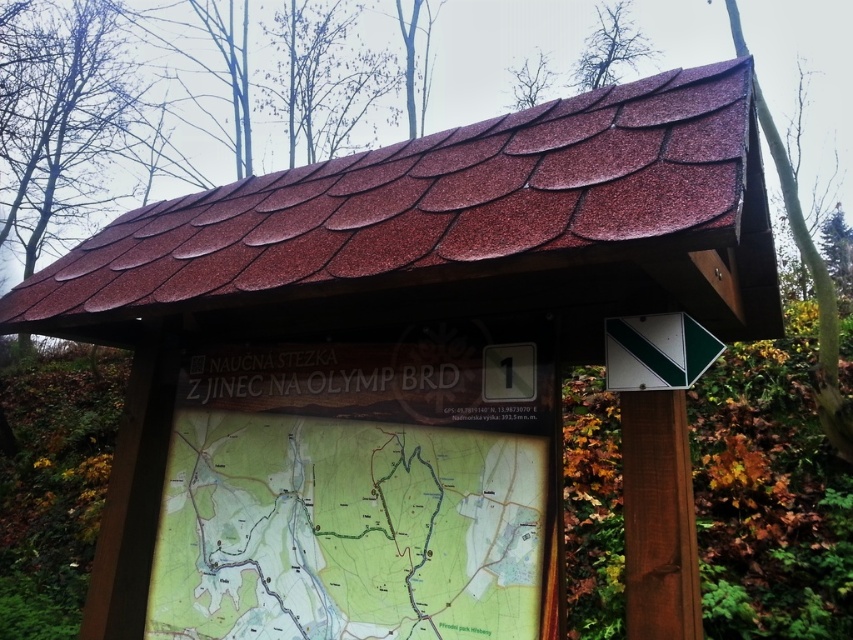
Between green matte map at center and green plastic sign at upper right, which one appears on the left side from the viewer's perspective?

From the viewer's perspective, green matte map at center appears more on the left side.

Can you confirm if green matte map at center is positioned to the right of green plastic sign at upper right?

Incorrect, green matte map at center is not on the right side of green plastic sign at upper right.

The image size is (853, 640). I want to click on green matte map at center, so click(x=347, y=531).

The image size is (853, 640). Identify the location of green matte map at center. (347, 531).